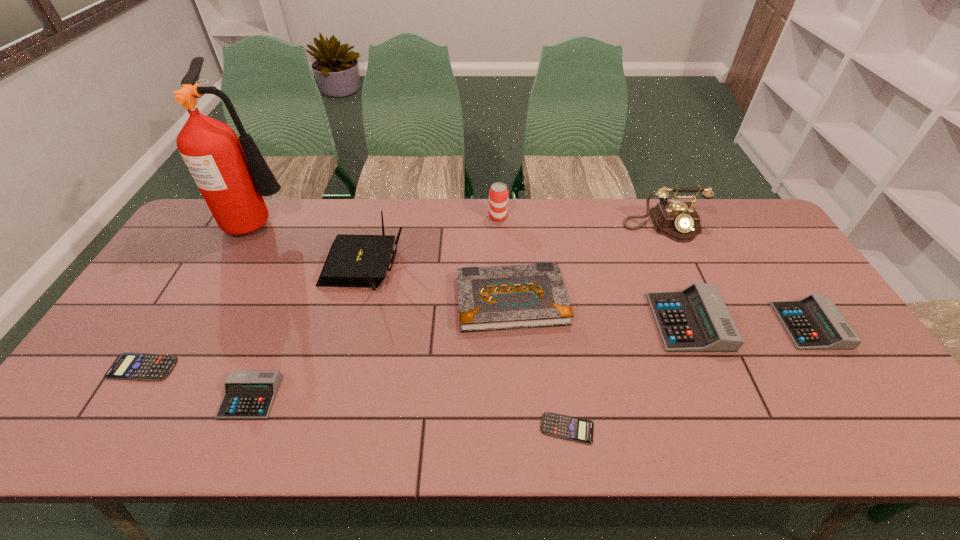
Where is `object that stands as the eighth closest to the notebook`? object that stands as the eighth closest to the notebook is located at coordinates (232, 175).

Locate an element on the screen. The width and height of the screenshot is (960, 540). object that stands as the sixth closest to the shortest calculator is located at coordinates (679, 221).

At what (x,y) coordinates should I click in order to perform the action: click on calculator identified as the fourth closest to the nearer blue calculator. Please return your answer as a coordinate pair (x, y). Looking at the image, I should click on (128, 366).

Identify which calculator is the fifth nearest to the router. Please provide its 2D coordinates. Your answer should be formatted as a tuple, i.e. [(x, y)], where the tuple contains the x and y coordinates of a point satisfying the conditions above.

[(814, 322)]

Where is `the second closest gray calculator relative to the beer can`? the second closest gray calculator relative to the beer can is located at coordinates (249, 394).

Identify which gray calculator is the second nearest to the shortest calculator. Please provide its 2D coordinates. Your answer should be formatted as a tuple, i.e. [(x, y)], where the tuple contains the x and y coordinates of a point satisfying the conditions above.

[(814, 322)]

At what (x,y) coordinates should I click in order to perform the action: click on vacant region that satisfies the following two spatial constraints: 1. at the nozzle of the tallest object; 2. on the right side of the nearer blue calculator. Please return your answer as a coordinate pair (x, y). The width and height of the screenshot is (960, 540). Looking at the image, I should click on (147, 429).

Locate an element on the screen. This screenshot has height=540, width=960. vacant region that satisfies the following two spatial constraints: 1. on the dial of the second tallest object; 2. on the right side of the second tallest calculator is located at coordinates (708, 326).

At what (x,y) coordinates should I click in order to perform the action: click on vacant space that satisfies the following two spatial constraints: 1. on the front side of the third tallest calculator; 2. on the left side of the leftmost calculator. Please return your answer as a coordinate pair (x, y). The height and width of the screenshot is (540, 960). Looking at the image, I should click on (125, 397).

Locate an element on the screen. This screenshot has height=540, width=960. free space in the image that satisfies the following two spatial constraints: 1. at the nozzle of the second calculator from right to left; 2. on the right side of the fire extinguisher is located at coordinates (205, 322).